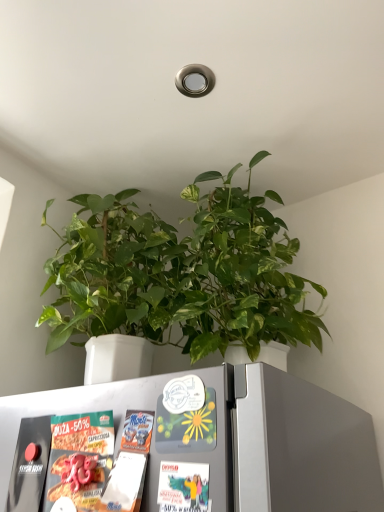
In order to face white matte refrigerator at lower center, should I rotate leftwards or rightwards?

Rotate your view left by about 13.880°.

Find the location of a particular element. white matte refrigerator at lower center is located at coordinates (240, 439).

What do you see at coordinates (240, 439) in the screenshot?
I see `white matte refrigerator at lower center` at bounding box center [240, 439].

Identify the location of green matte plant at center. This screenshot has height=512, width=384. (181, 273).

What do you see at coordinates (181, 273) in the screenshot? I see `green matte plant at center` at bounding box center [181, 273].

Locate an element on the screen. The height and width of the screenshot is (512, 384). white matte refrigerator at lower center is located at coordinates (240, 439).

Can you confirm if white matte refrigerator at lower center is positioned to the left of green matte plant at center?

Yes, white matte refrigerator at lower center is to the left of green matte plant at center.

Between white matte refrigerator at lower center and green matte plant at center, which one is positioned in front?

white matte refrigerator at lower center is more forward.

Considering the positions of point (14, 448) and point (87, 234), is point (14, 448) closer or farther from the camera than point (87, 234)?

Point (14, 448) is closer to the camera than point (87, 234).

From the image's perspective, between white matte refrigerator at lower center and green matte plant at center, which one is located above?

green matte plant at center.

From a real-world perspective, is white matte refrigerator at lower center on green matte plant at center?

No, from a real-world perspective, white matte refrigerator at lower center is not above green matte plant at center.

Does white matte refrigerator at lower center have a lesser width compared to green matte plant at center?

Yes, white matte refrigerator at lower center is thinner than green matte plant at center.

Between white matte refrigerator at lower center and green matte plant at center, which one has more height?

Standing taller between the two is green matte plant at center.

In the scene shown: Considering the sizes of objects white matte refrigerator at lower center and green matte plant at center in the image provided, who is bigger, white matte refrigerator at lower center or green matte plant at center?

With larger size is green matte plant at center.

Is green matte plant at center completely or partially inside white matte refrigerator at lower center?

No, green matte plant at center is located outside of white matte refrigerator at lower center.

Is white matte refrigerator at lower center directly adjacent to green matte plant at center?

No, white matte refrigerator at lower center is not touching green matte plant at center.

Does white matte refrigerator at lower center turn towards green matte plant at center?

No, white matte refrigerator at lower center is not aimed at green matte plant at center.

Can you tell me how much white matte refrigerator at lower center and green matte plant at center differ in facing direction?

There is a 1.49-degree angle between the facing directions of white matte refrigerator at lower center and green matte plant at center.

Identify the location of houseplant behind the white matte refrigerator at lower center. (181, 273).

Between green matte plant at center and white matte refrigerator at lower center, which one appears on the left side from the viewer's perspective?

Positioned to the left is white matte refrigerator at lower center.

Relative to white matte refrigerator at lower center, is green matte plant at center in front or behind?

Visually, green matte plant at center is located behind white matte refrigerator at lower center.

Considering the points (159, 225) and (239, 496), which point is in front, point (159, 225) or point (239, 496)?

Point (239, 496)

From the image's perspective, is green matte plant at center above or below white matte refrigerator at lower center?

Clearly, from the image's perspective, green matte plant at center is above white matte refrigerator at lower center.

From a real-world perspective, is green matte plant at center physically below white matte refrigerator at lower center?

No, from a real-world perspective, green matte plant at center is not beneath white matte refrigerator at lower center.

Is green matte plant at center thinner than white matte refrigerator at lower center?

No, green matte plant at center is not thinner than white matte refrigerator at lower center.

Which of these two, green matte plant at center or white matte refrigerator at lower center, stands taller?

With more height is green matte plant at center.

Looking at this image, who is smaller, green matte plant at center or white matte refrigerator at lower center?

Smaller between the two is white matte refrigerator at lower center.

Would you say green matte plant at center is inside or outside white matte refrigerator at lower center?

The correct answer is: outside.

Is green matte plant at center in contact with white matte refrigerator at lower center?

green matte plant at center is not next to white matte refrigerator at lower center, and they're not touching.

Is green matte plant at center facing towards white matte refrigerator at lower center?

No, green matte plant at center is not oriented towards white matte refrigerator at lower center.

Can you tell me how much green matte plant at center and white matte refrigerator at lower center differ in facing direction?

They differ by 1.49 degrees in their facing directions.

How far apart are green matte plant at center and white matte refrigerator at lower center?

green matte plant at center and white matte refrigerator at lower center are 14.68 inches apart from each other.

You are a GUI agent. You are given a task and a screenshot of the screen. Output one action in this format:
    pyautogui.click(x=<x>, y=<y>)
    Task: Click on the refrigerator lying below the green matte plant at center (from the image's perspective)
    The height and width of the screenshot is (512, 384).
    Given the screenshot: What is the action you would take?
    pyautogui.click(x=240, y=439)

Locate an element on the screen. This screenshot has height=512, width=384. houseplant positioned vertically above the white matte refrigerator at lower center (from a real-world perspective) is located at coordinates (181, 273).

What are the coordinates of `houseplant above the white matte refrigerator at lower center (from the image's perspective)` in the screenshot? It's located at (181, 273).